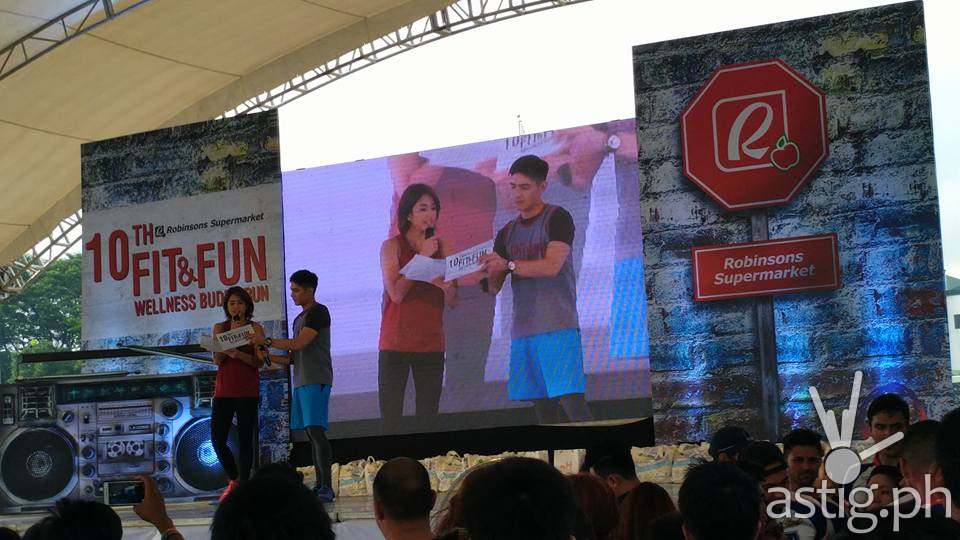
Identify the location of brick wall background. (868, 212), (210, 140).